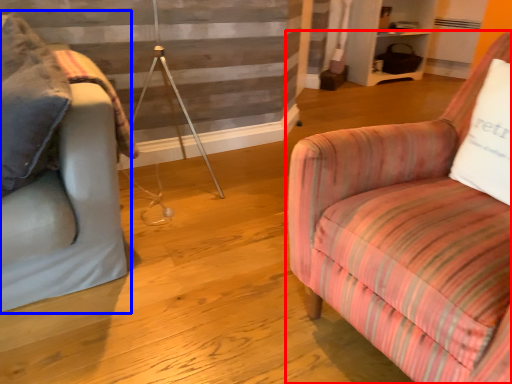
Question: Which point is further to the camera, chair (highlighted by a red box) or studio couch (highlighted by a blue box)?

Choices:
 (A) chair
 (B) studio couch

Answer: (B)